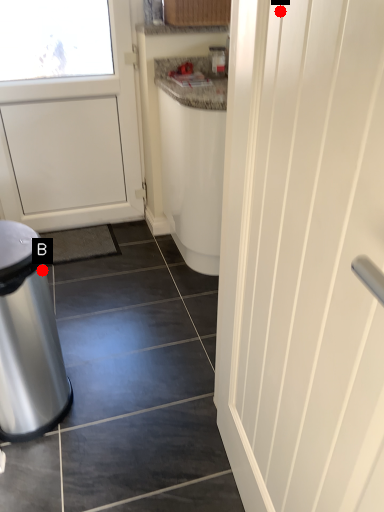
Question: Two points are circled on the image, labeled by A and B beside each circle. Which of the following is the farthest from the observer?

Choices:
 (A) A is further
 (B) B is further

Answer: (B)